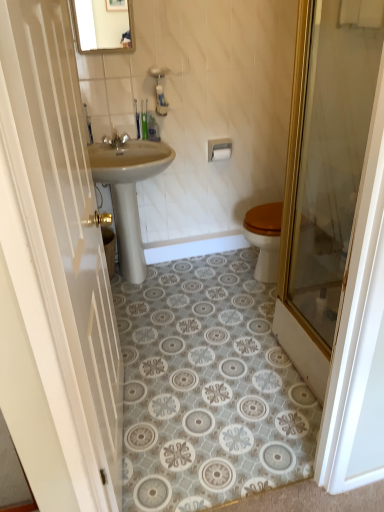
Question: Is beige ceramic sink at center to the right of white matte toilet paper at upper center from the viewer's perspective?

Choices:
 (A) no
 (B) yes

Answer: (A)

Question: From a real-world perspective, is beige ceramic sink at center positioned under white matte toilet paper at upper center based on gravity?

Choices:
 (A) yes
 (B) no

Answer: (A)

Question: Is beige ceramic sink at center surrounding white matte toilet paper at upper center?

Choices:
 (A) yes
 (B) no

Answer: (B)

Question: From the image's perspective, does beige ceramic sink at center appear higher than white matte toilet paper at upper center?

Choices:
 (A) yes
 (B) no

Answer: (B)

Question: Can you confirm if beige ceramic sink at center is bigger than white matte toilet paper at upper center?

Choices:
 (A) no
 (B) yes

Answer: (B)

Question: Is beige ceramic sink at center further to the viewer compared to white matte toilet paper at upper center?

Choices:
 (A) no
 (B) yes

Answer: (A)

Question: Would you say silver metallic faucet at upper center is outside white glossy door at left, arranged as the 1th door when viewed from the left?

Choices:
 (A) no
 (B) yes

Answer: (B)

Question: Can you confirm if silver metallic faucet at upper center is shorter than white glossy door at left, the 2th door from the right?

Choices:
 (A) no
 (B) yes

Answer: (B)

Question: Does silver metallic faucet at upper center lie in front of white glossy door at left, the 2th door from the right?

Choices:
 (A) yes
 (B) no

Answer: (B)

Question: Does silver metallic faucet at upper center turn towards white glossy door at left, the 2th door from the right?

Choices:
 (A) no
 (B) yes

Answer: (B)

Question: Does silver metallic faucet at upper center have a greater width compared to white glossy door at left, the 2th door from the right?

Choices:
 (A) no
 (B) yes

Answer: (A)

Question: From a real-world perspective, is silver metallic faucet at upper center located higher than white glossy door at left, arranged as the 1th door when viewed from the left?

Choices:
 (A) no
 (B) yes

Answer: (B)

Question: Considering the relative sizes of white glossy door at left, arranged as the 1th door when viewed from the left, and beige ceramic sink at center in the image provided, is white glossy door at left, arranged as the 1th door when viewed from the left, thinner than beige ceramic sink at center?

Choices:
 (A) yes
 (B) no

Answer: (A)